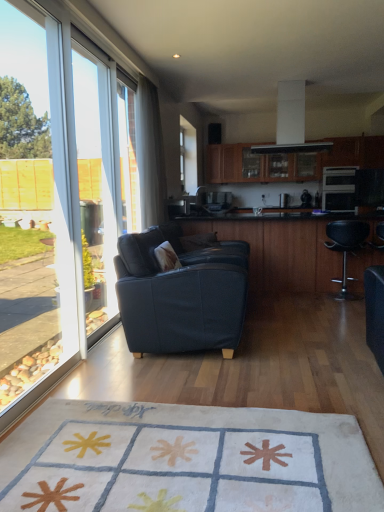
In order to click on vacant space positioned to the left of black leather bar stool at right in this screenshot , I will do `click(303, 300)`.